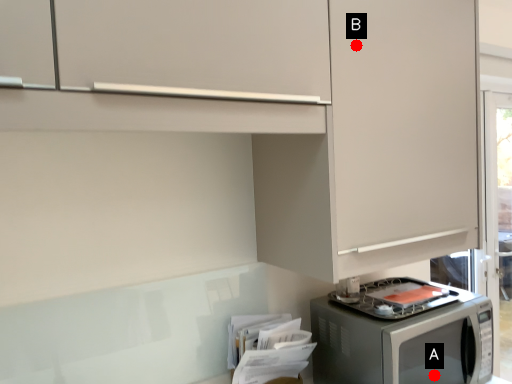
Question: Two points are circled on the image, labeled by A and B beside each circle. Which point is farther to the camera?

Choices:
 (A) A is further
 (B) B is further

Answer: (A)